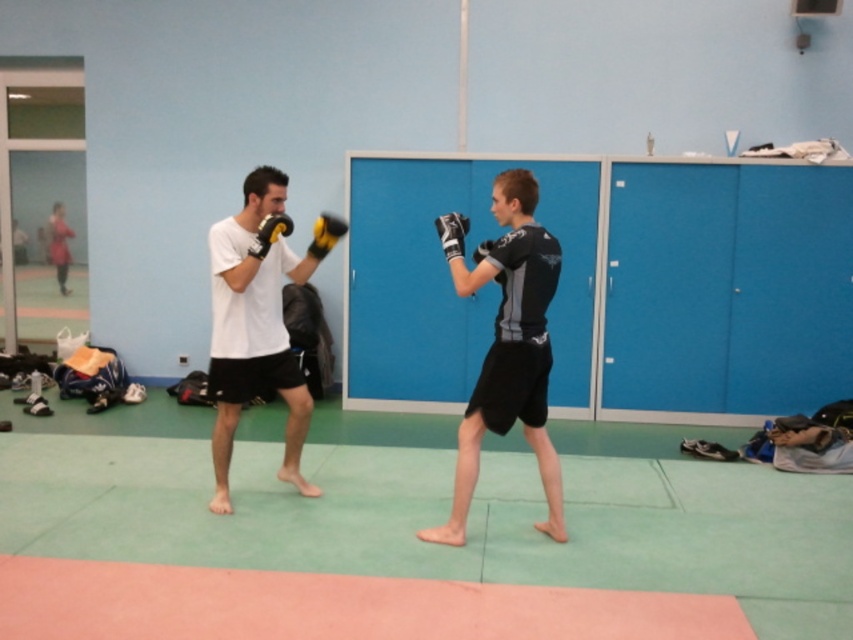
Question: Which of the following is the closest to the observer?

Choices:
 (A) (442, 236)
 (B) (273, 212)

Answer: (A)

Question: Is black matte/soft boxing gloves at center bigger than white matte t-shirt at center?

Choices:
 (A) yes
 (B) no

Answer: (B)

Question: Observing the image, what is the correct spatial positioning of white matte t-shirt at center in reference to matte black boxing glove at left?

Choices:
 (A) right
 (B) left

Answer: (B)

Question: Can you confirm if matte black boxing glove at center is bigger than yellow matte boxing glove at upper center?

Choices:
 (A) no
 (B) yes

Answer: (B)

Question: Which object appears farthest from the camera in this image?

Choices:
 (A) black matte/soft boxing gloves at center
 (B) matte black boxing glove at center

Answer: (B)

Question: Which of the following is the closest to the observer?

Choices:
 (A) black matte/soft boxing gloves at center
 (B) matte black boxing glove at left
 (C) white matte t-shirt at center
 (D) matte black boxing glove at center

Answer: (A)